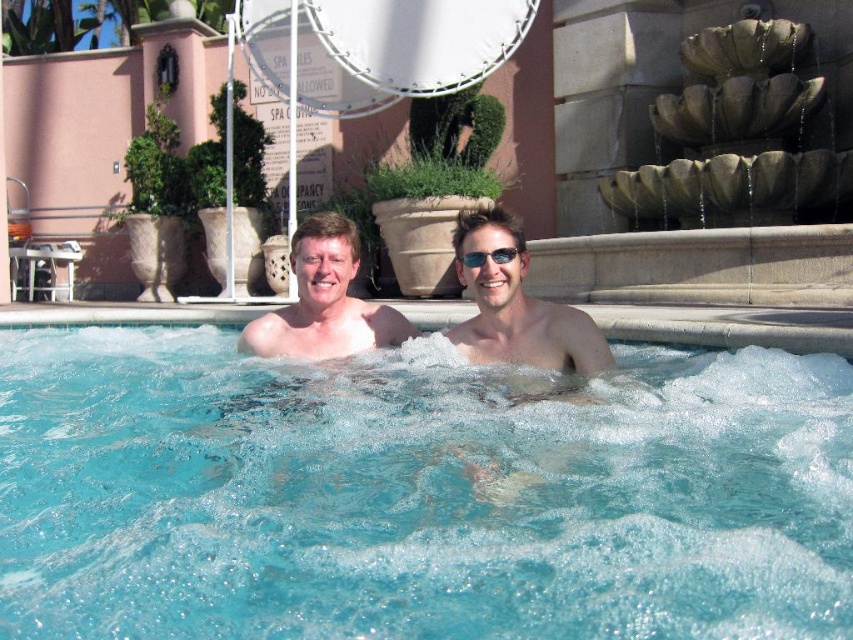
You are a lifeguard who needs to monitor the clear blue water at center and the matte skin at center. Which object is closer to the bottom of the hot tub?

The clear blue water at center is located below matte skin at center, so the clear blue water at center is closer to the bottom of the hot tub.